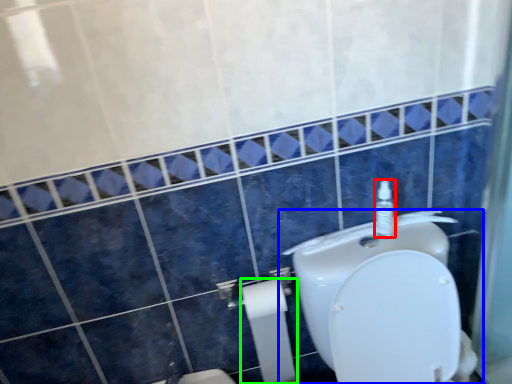
Question: Considering the real-world distances, which object is farthest from soap dispenser (highlighted by a red box)? toilet (highlighted by a blue box) or toilet paper (highlighted by a green box)?

Choices:
 (A) toilet
 (B) toilet paper

Answer: (B)